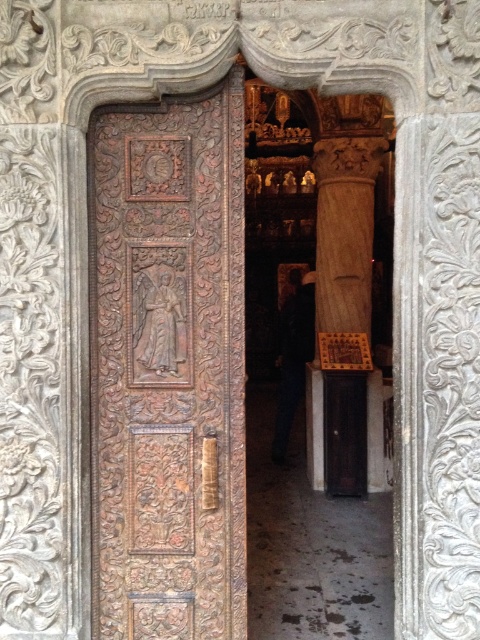
Question: Does carved wood door at center lie in front of smooth stone column at center?

Choices:
 (A) no
 (B) yes

Answer: (B)

Question: Which object appears farthest from the camera in this image?

Choices:
 (A) carved wood door at center
 (B) smooth stone column at center

Answer: (B)

Question: Is carved wood door at center to the left of smooth stone column at center from the viewer's perspective?

Choices:
 (A) no
 (B) yes

Answer: (B)

Question: Does carved wood door at center have a greater width compared to smooth stone column at center?

Choices:
 (A) no
 (B) yes

Answer: (B)

Question: Among these objects, which one is nearest to the camera?

Choices:
 (A) carved wood door at center
 (B) smooth stone column at center

Answer: (A)

Question: Among these points, which one is nearest to the camera?

Choices:
 (A) (360, 241)
 (B) (212, 580)

Answer: (B)